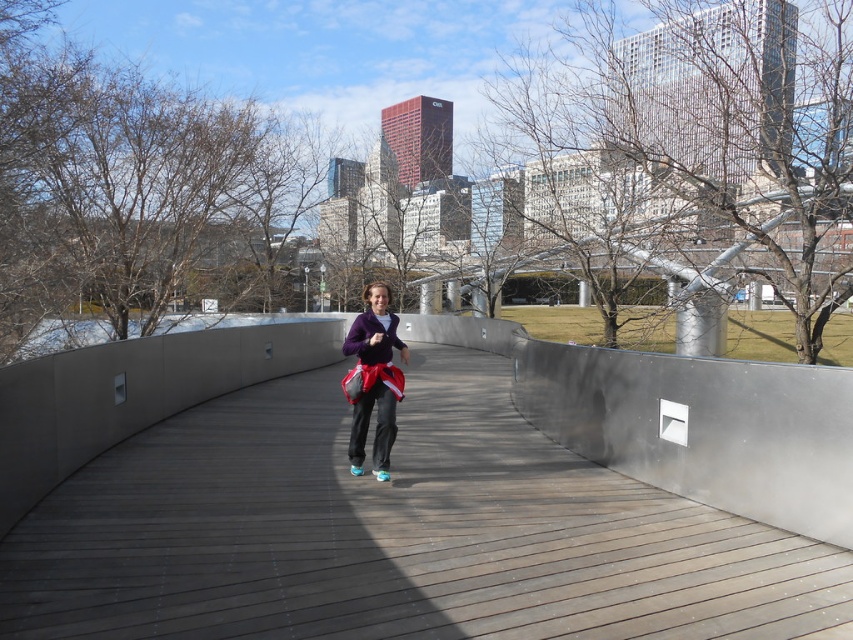
Does wooden at center lie in front of purple fleece sweatshirt at center?

Yes, wooden at center is in front of purple fleece sweatshirt at center.

Is point (1, 563) closer to viewer compared to point (361, 342)?

Yes, point (1, 563) is in front of point (361, 342).

I want to click on wooden at center, so click(x=397, y=531).

Does point (126, 552) lie behind point (368, 346)?

No, (126, 552) is in front of (368, 346).

Does wooden at center appear under matte purple jacket at center?

Indeed, wooden at center is positioned under matte purple jacket at center.

Between point (457, 572) and point (355, 388), which one is positioned in front?

Point (457, 572) is more forward.

This screenshot has height=640, width=853. What are the coordinates of `wooden at center` in the screenshot? It's located at (397, 531).

Does matte purple jacket at center come in front of purple fleece sweatshirt at center?

No.

Can you confirm if matte purple jacket at center is positioned to the right of purple fleece sweatshirt at center?

In fact, matte purple jacket at center is to the left of purple fleece sweatshirt at center.

Who is more distant from viewer, (x=343, y=381) or (x=379, y=332)?

The point (x=343, y=381) is behind.

This screenshot has height=640, width=853. Find the location of `matte purple jacket at center`. matte purple jacket at center is located at coordinates (373, 380).